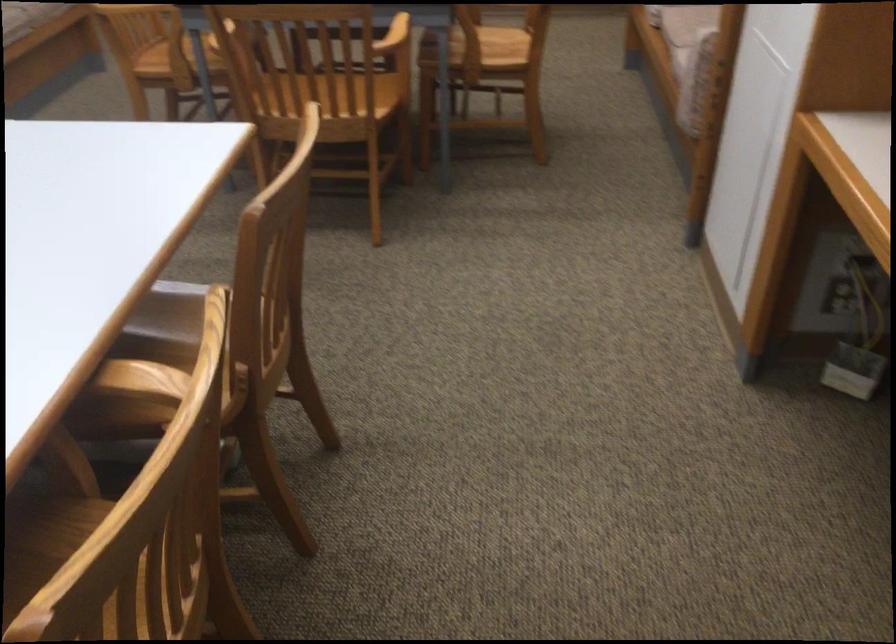
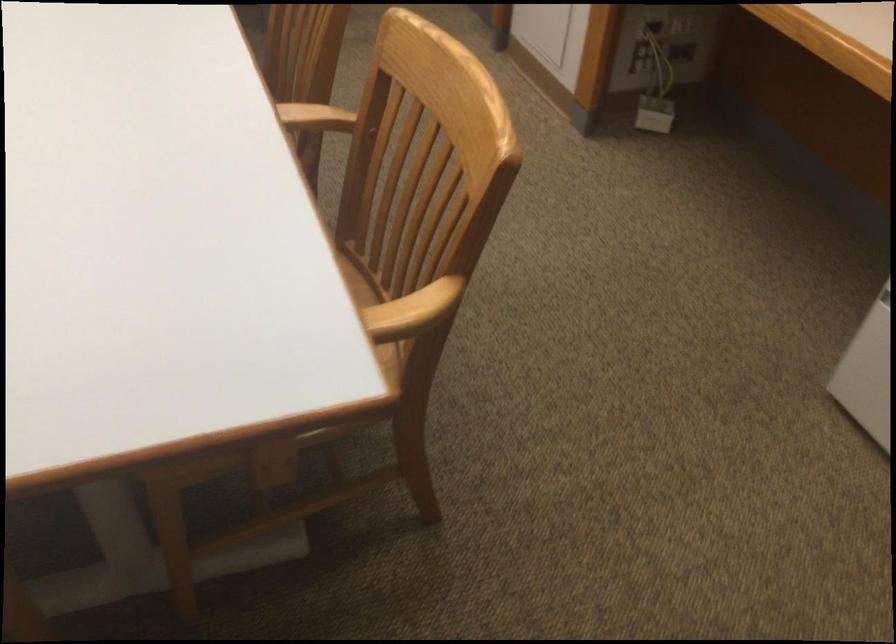
Question: The camera is either moving clockwise (left) or counter-clockwise (right) around the object. The first image is from the beginning of the video and the second image is from the end. Is the camera moving left or right when shooting the video?

Choices:
 (A) Left
 (B) Right

Answer: (A)